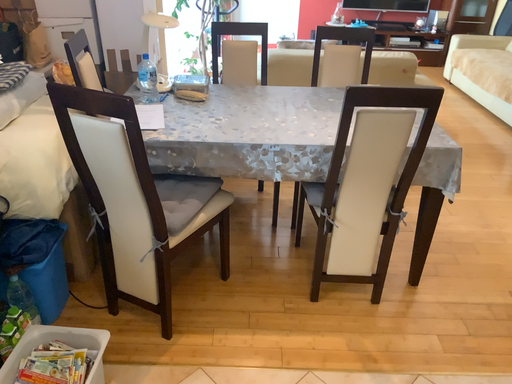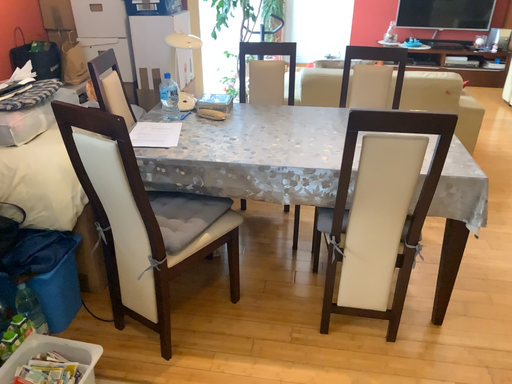
Question: How did the camera likely rotate when shooting the video?

Choices:
 (A) rotated right
 (B) rotated left

Answer: (B)